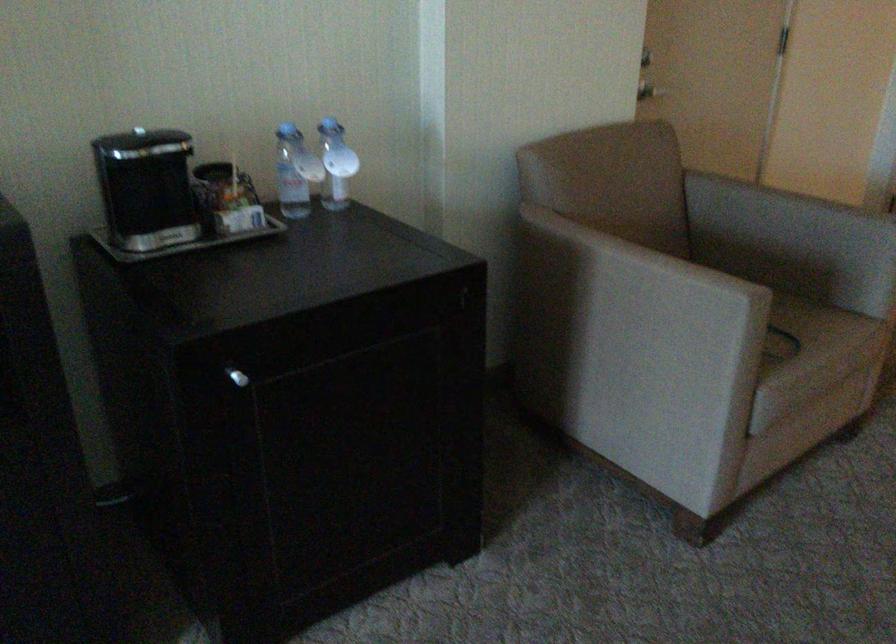
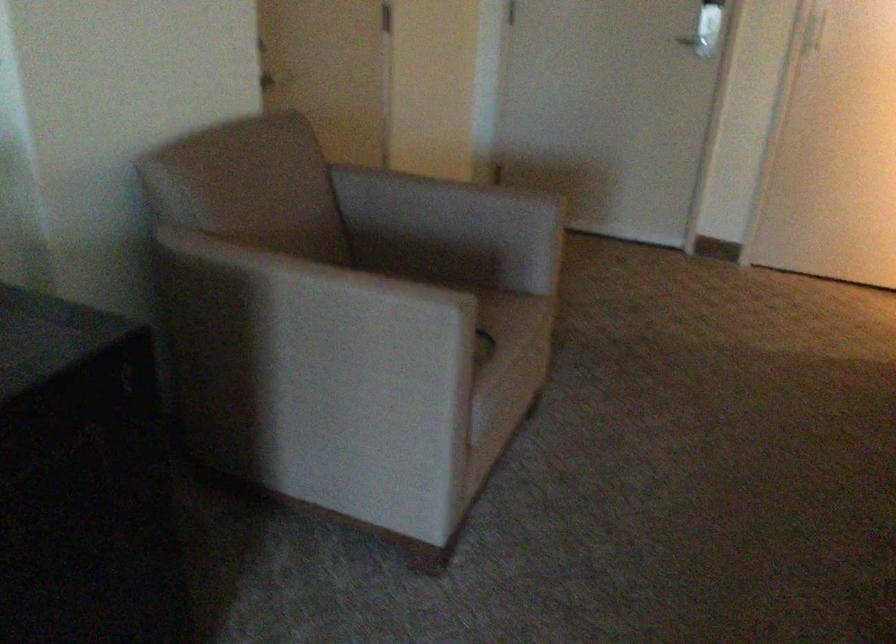
Question: The camera is either moving clockwise (left) or counter-clockwise (right) around the object. The first image is from the beginning of the video and the second image is from the end. Is the camera moving left or right when shooting the video?

Choices:
 (A) Left
 (B) Right

Answer: (A)